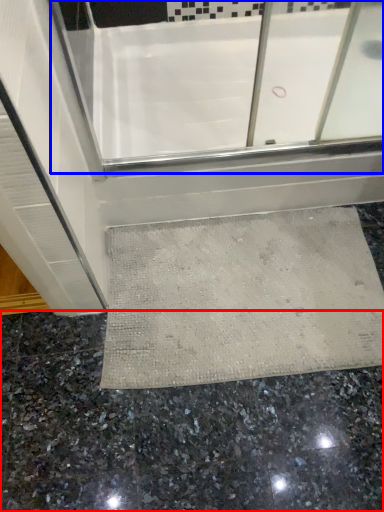
Question: Which object is further to the camera taking this photo, granite (highlighted by a red box) or bath (highlighted by a blue box)?

Choices:
 (A) granite
 (B) bath

Answer: (B)